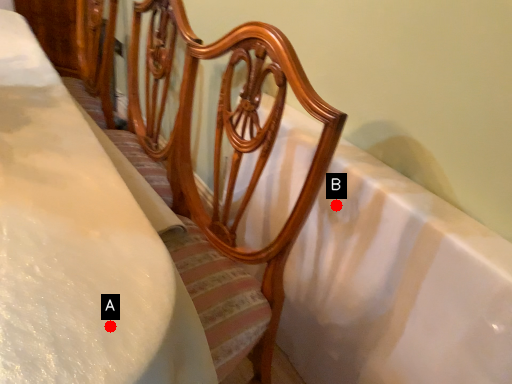
Question: Two points are circled on the image, labeled by A and B beside each circle. Which point is closer to the camera?

Choices:
 (A) A is closer
 (B) B is closer

Answer: (A)